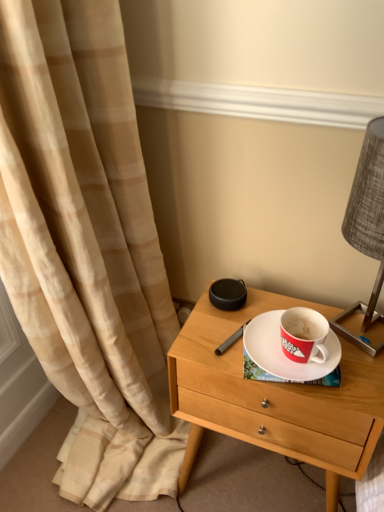
Question: Would you say light wood/finish nightstand at center is a long distance from white matte saucer at center?

Choices:
 (A) no
 (B) yes

Answer: (A)

Question: Is light wood/finish nightstand at center further to camera compared to white matte saucer at center?

Choices:
 (A) yes
 (B) no

Answer: (B)

Question: Is light wood/finish nightstand at center to the left of white matte saucer at center from the viewer's perspective?

Choices:
 (A) yes
 (B) no

Answer: (A)

Question: Is light wood/finish nightstand at center positioned with its back to white matte saucer at center?

Choices:
 (A) yes
 (B) no

Answer: (B)

Question: Is light wood/finish nightstand at center positioned beyond the bounds of white matte saucer at center?

Choices:
 (A) yes
 (B) no

Answer: (A)

Question: Are light wood/finish nightstand at center and white matte saucer at center making contact?

Choices:
 (A) yes
 (B) no

Answer: (B)

Question: Is textured gray lampshade at right located outside light wood/finish nightstand at center?

Choices:
 (A) yes
 (B) no

Answer: (A)

Question: Would you say light wood/finish nightstand at center is part of textured gray lampshade at right's contents?

Choices:
 (A) no
 (B) yes

Answer: (A)

Question: Can you confirm if textured gray lampshade at right is smaller than light wood/finish nightstand at center?

Choices:
 (A) no
 (B) yes

Answer: (B)

Question: From the image's perspective, would you say textured gray lampshade at right is shown under light wood/finish nightstand at center?

Choices:
 (A) no
 (B) yes

Answer: (A)

Question: Is textured gray lampshade at right positioned behind light wood/finish nightstand at center?

Choices:
 (A) no
 (B) yes

Answer: (A)

Question: From the image's perspective, is textured gray lampshade at right above light wood/finish nightstand at center?

Choices:
 (A) no
 (B) yes

Answer: (B)

Question: Considering the relative sizes of white matte saucer at center and textured gray lampshade at right in the image provided, is white matte saucer at center shorter than textured gray lampshade at right?

Choices:
 (A) yes
 (B) no

Answer: (A)